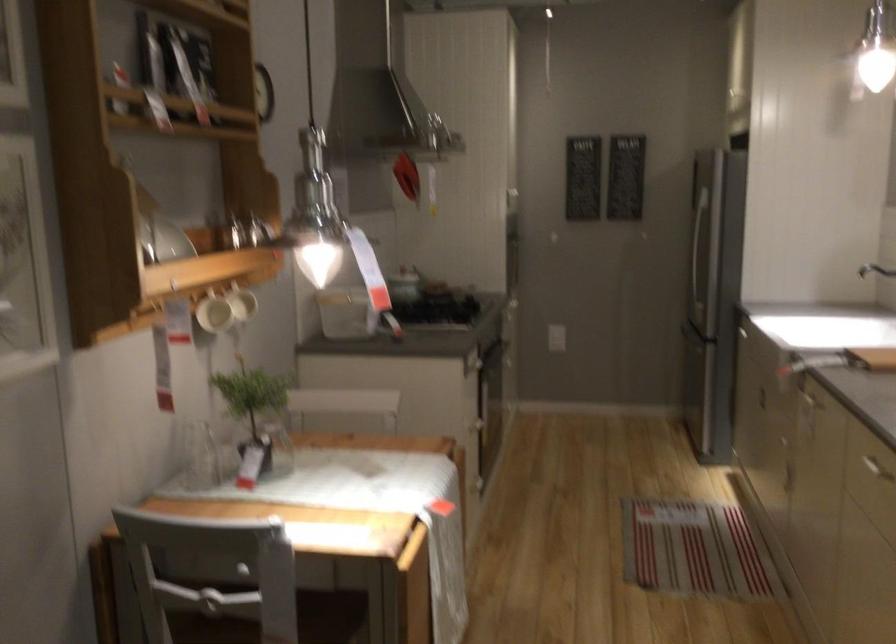
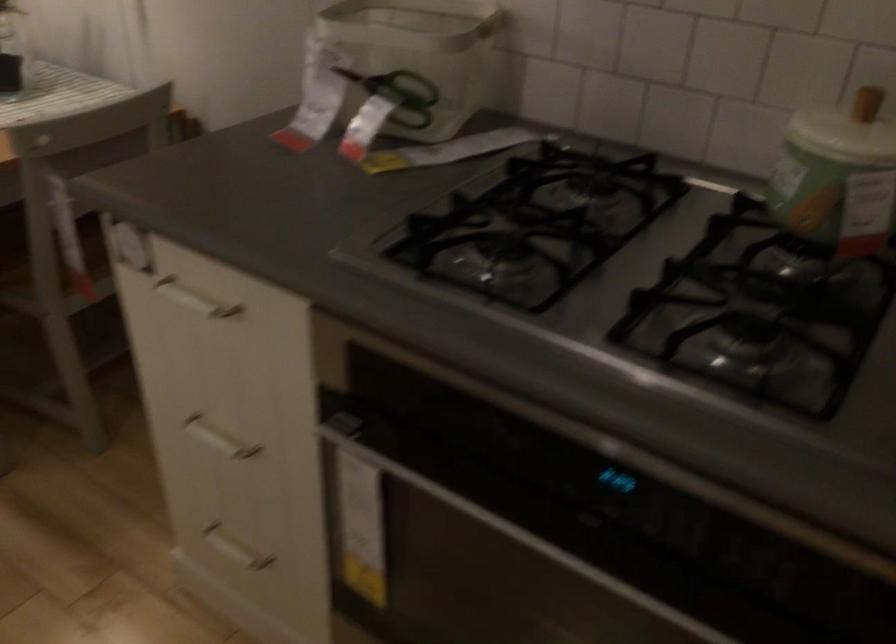
Locate, in the second image, the point that corresponds to the point at 480,433 in the first image.

(218, 438)